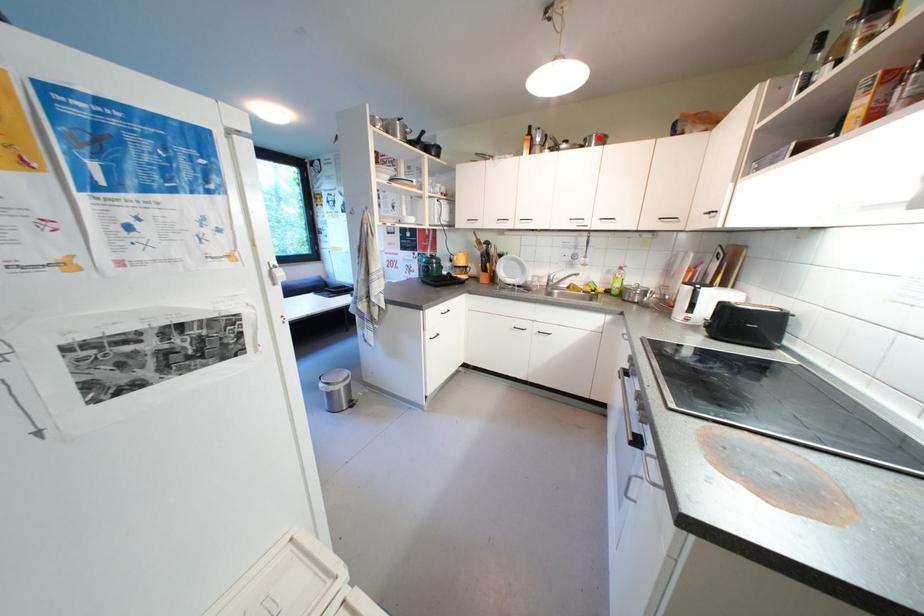
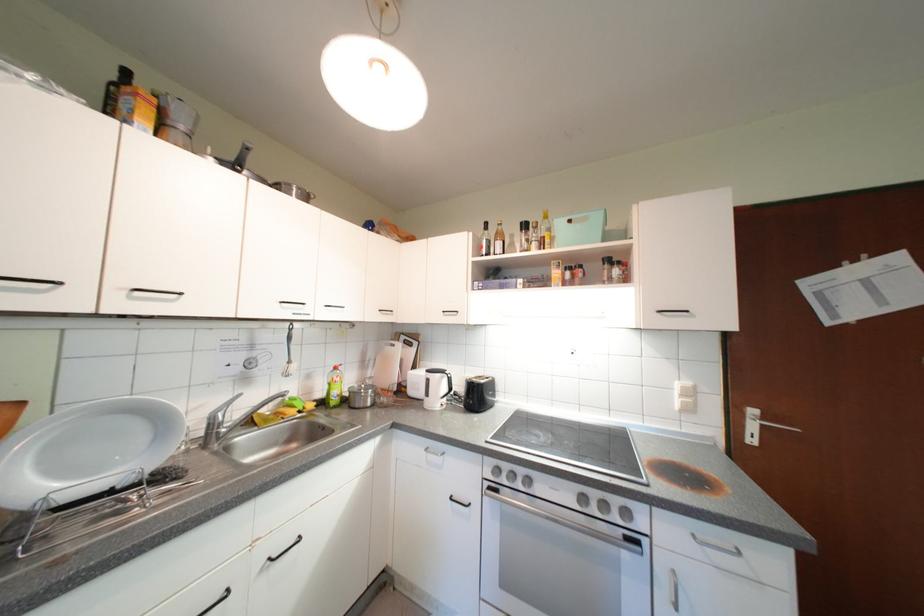
Where in the second image is the point corresponding to the highlighted location from the first image?

(298, 187)